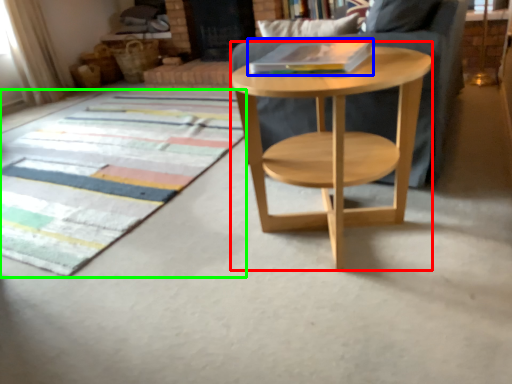
Question: Considering the real-world distances, which object is closest to round table (highlighted by a red box)? book (highlighted by a blue box) or mat (highlighted by a green box).

Choices:
 (A) book
 (B) mat

Answer: (A)